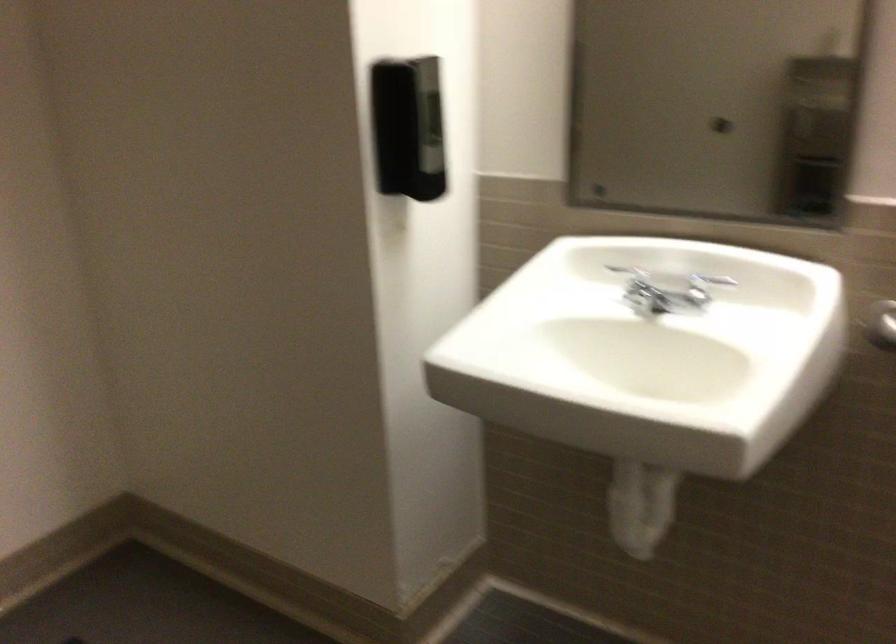
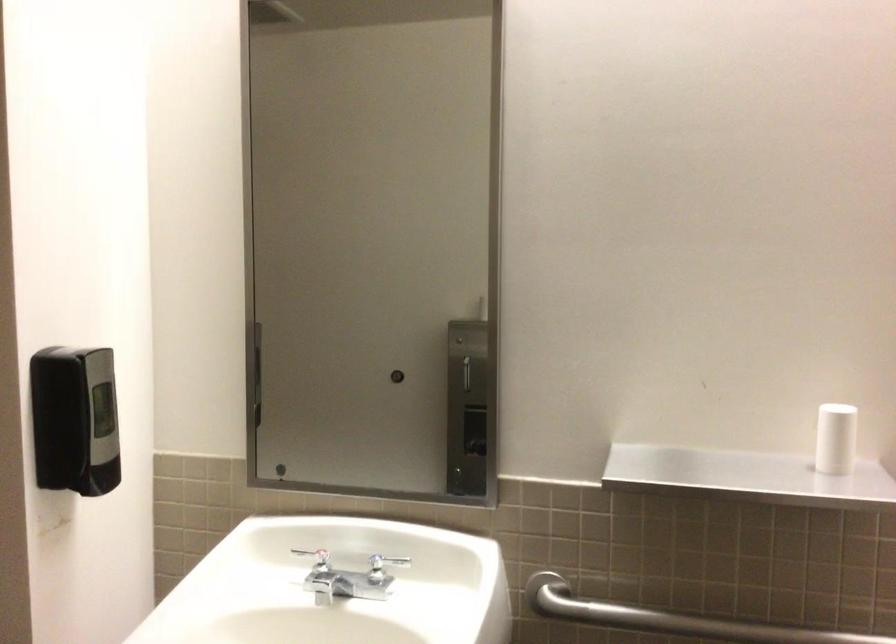
Question: The camera is either moving clockwise (left) or counter-clockwise (right) around the object. The first image is from the beginning of the video and the second image is from the end. Is the camera moving left or right when shooting the video?

Choices:
 (A) Left
 (B) Right

Answer: (A)